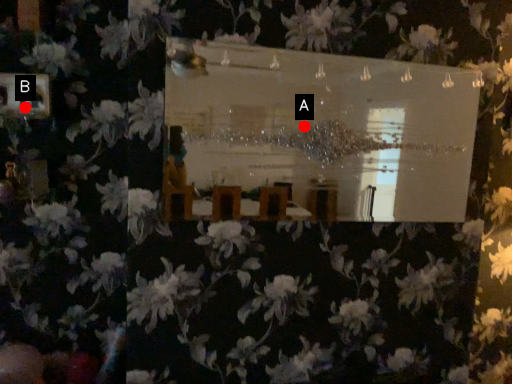
Question: Two points are circled on the image, labeled by A and B beside each circle. Which point is closer to the camera?

Choices:
 (A) A is closer
 (B) B is closer

Answer: (A)